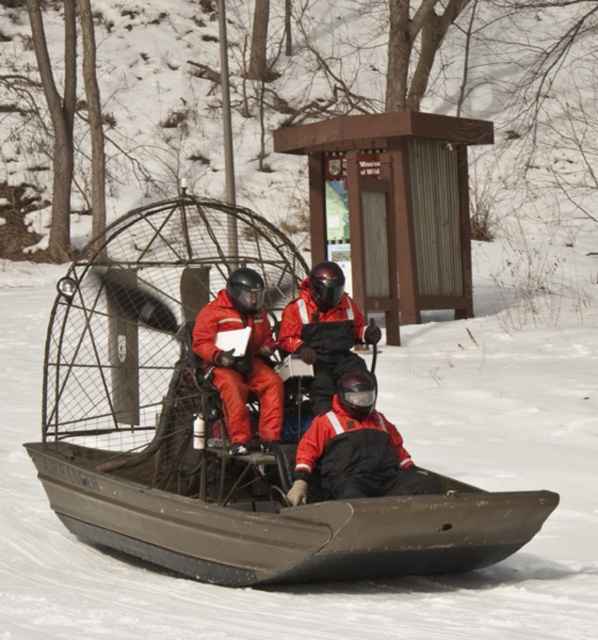
Question: Can you confirm if black matte jacket at center is smaller than matte red jacket at center?

Choices:
 (A) yes
 (B) no

Answer: (A)

Question: Is brown matte snowmobile at center smaller than matte orange jumpsuit at center?

Choices:
 (A) no
 (B) yes

Answer: (A)

Question: Which of the following is the farthest from the observer?

Choices:
 (A) click(x=260, y=387)
 (B) click(x=367, y=438)
 (C) click(x=292, y=316)
 (D) click(x=249, y=525)

Answer: (C)

Question: Which of the following is the closest to the observer?

Choices:
 (A) black matte jacket at center
 (B) brown matte snowmobile at center

Answer: (B)

Question: Is black matte jacket at center to the right of matte orange jumpsuit at center from the viewer's perspective?

Choices:
 (A) yes
 (B) no

Answer: (A)

Question: Which object is closer to the camera taking this photo?

Choices:
 (A) matte red jacket at center
 (B) matte orange jumpsuit at center
 (C) black matte jacket at center

Answer: (C)